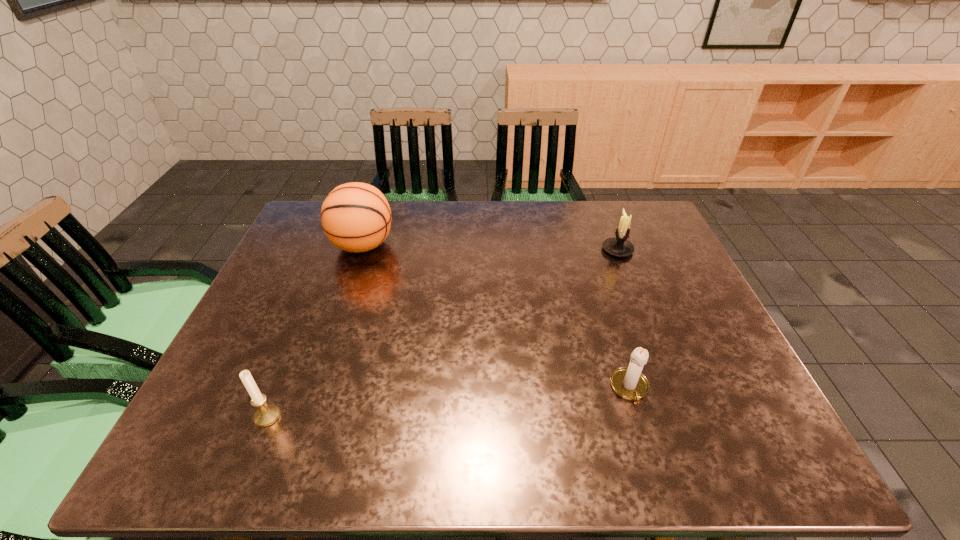
The height and width of the screenshot is (540, 960). I want to click on free region at the near edge of the desktop, so click(x=580, y=446).

Where is `vacant space at the left edge`? This screenshot has height=540, width=960. vacant space at the left edge is located at coordinates (287, 315).

Where is `free space at the right edge of the desktop`? This screenshot has width=960, height=540. free space at the right edge of the desktop is located at coordinates (666, 330).

The height and width of the screenshot is (540, 960). I want to click on vacant region at the far left corner of the desktop, so tap(318, 231).

The width and height of the screenshot is (960, 540). In the image, there is a desktop. What are the coordinates of `free space at the far right corner` in the screenshot? It's located at (636, 206).

At what (x,y) coordinates should I click in order to perform the action: click on free space between the second candle holder from right to left and the basketball. Please return your answer as a coordinate pair (x, y). This screenshot has width=960, height=540. Looking at the image, I should click on (496, 317).

Find the location of a particular element. Image resolution: width=960 pixels, height=540 pixels. vacant space in between the rightmost object and the leftmost candle holder is located at coordinates (443, 333).

At what (x,y) coordinates should I click in order to perform the action: click on free space between the farthest candle holder and the leftmost candle holder. Please return your answer as a coordinate pair (x, y). Image resolution: width=960 pixels, height=540 pixels. Looking at the image, I should click on (443, 333).

This screenshot has width=960, height=540. Find the location of `free spot between the shortest object and the tallest object`. free spot between the shortest object and the tallest object is located at coordinates (496, 317).

Locate an element on the screen. The width and height of the screenshot is (960, 540). unoccupied area between the basketball and the second candle holder from right to left is located at coordinates (496, 317).